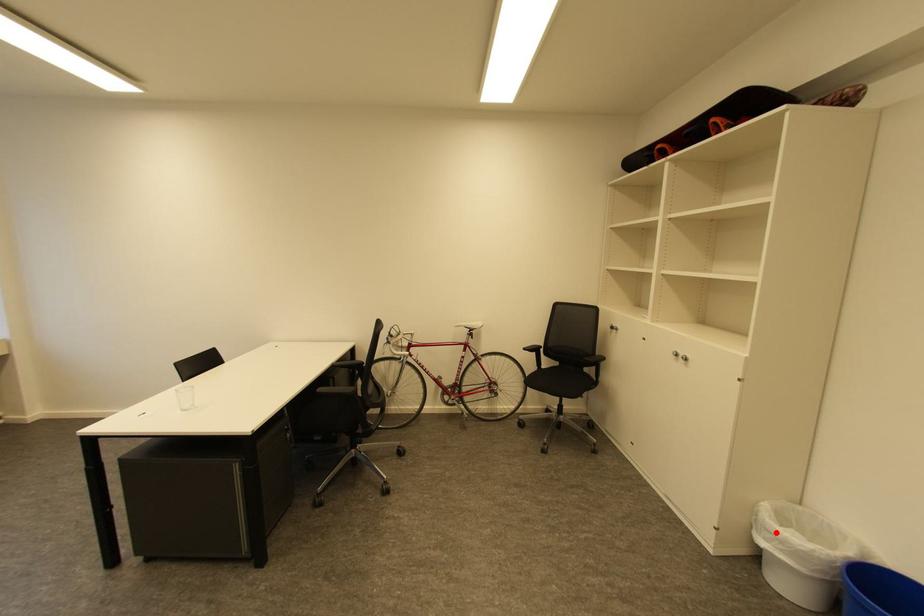
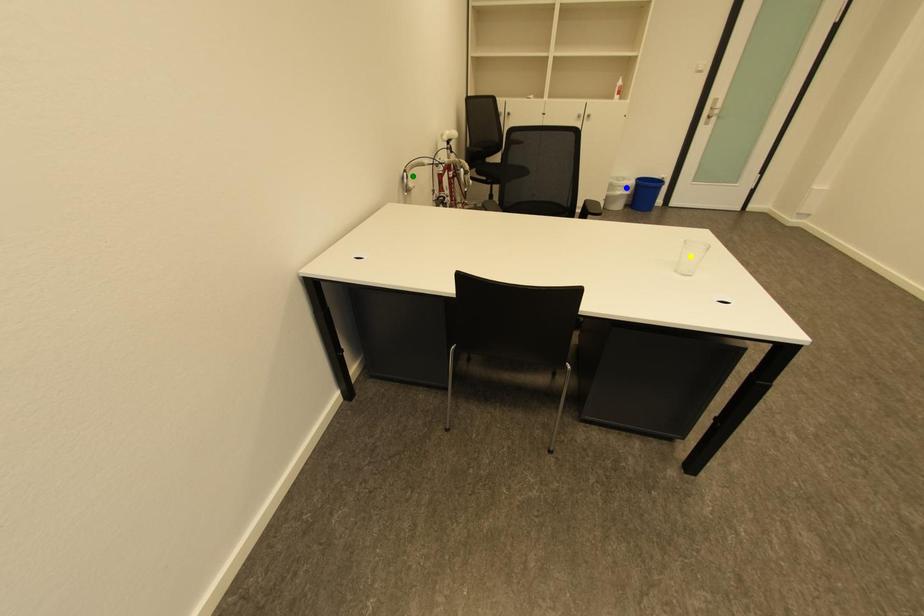
Question: I am providing you with two images of the same scene from different viewpoints. A red point is marked on the first image. You are given multiple points on the second image. Which mark in image 2 goes with the point in image 1?

Choices:
 (A) green point
 (B) yellow point
 (C) blue point

Answer: (C)